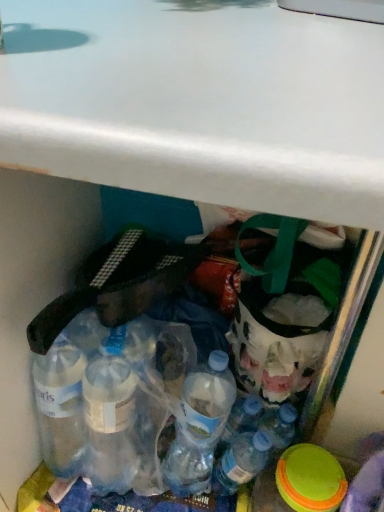
Image resolution: width=384 pixels, height=512 pixels. Find the location of `translucent plastic bottle at center`. translucent plastic bottle at center is located at coordinates (241, 461).

This screenshot has width=384, height=512. What do you see at coordinates (241, 461) in the screenshot?
I see `translucent plastic bottle at center` at bounding box center [241, 461].

In order to click on translucent plastic bottle at center in this screenshot , I will do `click(241, 461)`.